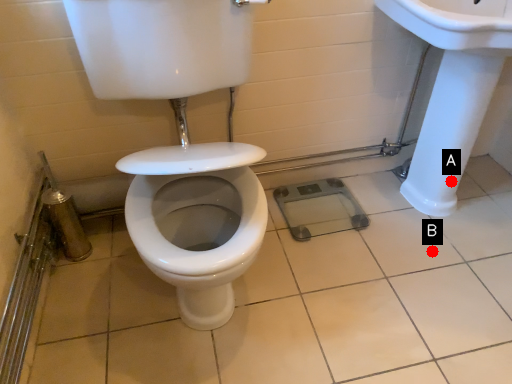
Question: Two points are circled on the image, labeled by A and B beside each circle. Which point is closer to the camera?

Choices:
 (A) A is closer
 (B) B is closer

Answer: (B)